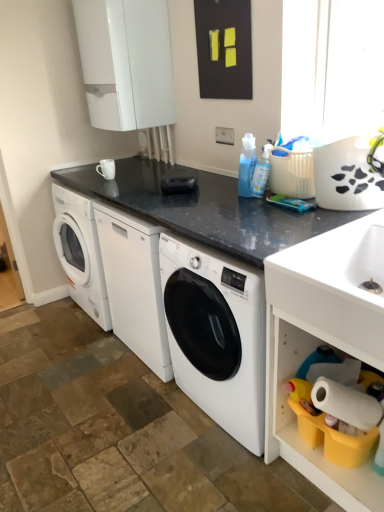
What is the approximate height of blue glossy bottle at center?

The height of blue glossy bottle at center is 10.98 inches.

This screenshot has width=384, height=512. What do you see at coordinates (205, 209) in the screenshot?
I see `black granite countertop at center` at bounding box center [205, 209].

What do you see at coordinates (335, 286) in the screenshot?
I see `white glossy sink at lower right` at bounding box center [335, 286].

Locate an element on the screen. The width and height of the screenshot is (384, 512). blue glossy bottle at center is located at coordinates (246, 165).

Is white glossy sink at lower right located within white plastic shelf at lower right?

Yes, white plastic shelf at lower right is surrounding white glossy sink at lower right.

Measure the distance from white plastic shelf at lower right to white glossy sink at lower right.

11.24 inches.

Is white glossy sink at lower right at the back of white plastic shelf at lower right?

No, white plastic shelf at lower right's orientation is not away from white glossy sink at lower right.

Does point (309, 450) lie in front of point (328, 328)?

That is False.

Can white glossy sink at lower right be found inside black granite countertop at center?

No, white glossy sink at lower right is not inside black granite countertop at center.

Which is in front, point (332, 220) or point (315, 312)?

Positioned in front is point (315, 312).

Considering the sizes of objects black granite countertop at center and white glossy sink at lower right in the image provided, who is wider, black granite countertop at center or white glossy sink at lower right?

With larger width is black granite countertop at center.

From the picture: Is black granite countertop at center looking in the opposite direction of white glossy sink at lower right?

black granite countertop at center is not turned away from white glossy sink at lower right.

From the image's perspective, is black granite countertop at center positioned above or below blue glossy bottle at center?

From the image's perspective, black granite countertop at center appears below blue glossy bottle at center.

Looking at this image, is black granite countertop at center placed right next to blue glossy bottle at center?

black granite countertop at center and blue glossy bottle at center are clearly separated.

Considering the relative positions of black granite countertop at center and blue glossy bottle at center in the image provided, is black granite countertop at center to the right of blue glossy bottle at center from the viewer's perspective?

No.

From a real-world perspective, is white plastic shelf at lower right positioned under black granite countertop at center based on gravity?

Yes.

Identify the location of shelf below the black granite countertop at center (from a real-world perspective). The width and height of the screenshot is (384, 512). (295, 417).

From the image's perspective, between white plastic shelf at lower right and black granite countertop at center, who is located below?

From the image's view, white plastic shelf at lower right is below.

Would you consider white plastic shelf at lower right to be distant from blue glossy bottle at center?

No, white plastic shelf at lower right is in close proximity to blue glossy bottle at center.

Is white plastic shelf at lower right wider or thinner than blue glossy bottle at center?

Clearly, white plastic shelf at lower right has more width compared to blue glossy bottle at center.

Considering the sizes of white plastic shelf at lower right and blue glossy bottle at center in the image, is white plastic shelf at lower right bigger or smaller than blue glossy bottle at center?

white plastic shelf at lower right is bigger than blue glossy bottle at center.

Which is more to the right, white plastic shelf at lower right or blue glossy bottle at center?

white plastic shelf at lower right.

Which object is wider, blue glossy bottle at center or white glossy sink at lower right?

With larger width is white glossy sink at lower right.

Based on the photo, is blue glossy bottle at center positioned in front of white glossy sink at lower right?

No, blue glossy bottle at center is behind white glossy sink at lower right.

From the image's perspective, relative to white glossy sink at lower right, is blue glossy bottle at center above or below?

Based on their image positions, blue glossy bottle at center is located above white glossy sink at lower right.

How distant is blue glossy bottle at center from white glossy sink at lower right?

blue glossy bottle at center and white glossy sink at lower right are 28.29 inches apart.

What's the angular difference between white glossy sink at lower right and white plastic shelf at lower right's facing directions?

The angular difference between white glossy sink at lower right and white plastic shelf at lower right is 1.68 degrees.

Is white glossy sink at lower right aimed at white plastic shelf at lower right?

Yes, white glossy sink at lower right is oriented towards white plastic shelf at lower right.

From the image's perspective, is white glossy sink at lower right under white plastic shelf at lower right?

No, from the image's perspective, white glossy sink at lower right is not beneath white plastic shelf at lower right.

From a real-world perspective, which object stands above the other?

In real-world perspective, white glossy sink at lower right is above.

Where is `shelf that appears in front of the white glossy sink at lower right`? shelf that appears in front of the white glossy sink at lower right is located at coordinates (295, 417).

Locate an element on the screen. countertop on the left of white glossy sink at lower right is located at coordinates (205, 209).

Which object lies further to the anchor point white glossy sink at lower right, black granite countertop at center or blue glossy bottle at center?

blue glossy bottle at center is further to white glossy sink at lower right.

Based on the photo, estimate the real-world distances between objects in this image. Which object is further from white plastic shelf at lower right, black granite countertop at center or white glossy sink at lower right?

black granite countertop at center is positioned further to the anchor white plastic shelf at lower right.

From the picture: Looking at the image, which one is located closer to white plastic shelf at lower right, blue glossy bottle at center or white glossy sink at lower right?

white glossy sink at lower right is positioned closer to the anchor white plastic shelf at lower right.

Looking at the image, which one is located closer to blue glossy bottle at center, black granite countertop at center or white plastic shelf at lower right?

The object closer to blue glossy bottle at center is black granite countertop at center.

From the image, which object appears to be nearer to white glossy sink at lower right, white plastic shelf at lower right or blue glossy bottle at center?

Among the two, white plastic shelf at lower right is located nearer to white glossy sink at lower right.

From the image, which object appears to be farther from black granite countertop at center, white glossy sink at lower right or white plastic shelf at lower right?

→ The object further to black granite countertop at center is white plastic shelf at lower right.

Which object lies nearer to the anchor point blue glossy bottle at center, white glossy sink at lower right or black granite countertop at center?

black granite countertop at center is positioned closer to the anchor blue glossy bottle at center.

Estimate the real-world distances between objects in this image. Which object is further from blue glossy bottle at center, black granite countertop at center or white glossy sink at lower right?

white glossy sink at lower right.

This screenshot has width=384, height=512. Identify the location of countertop located between white glossy sink at lower right and blue glossy bottle at center in the depth direction. (205, 209).

I want to click on countertop between white plastic shelf at lower right and blue glossy bottle at center along the z-axis, so click(205, 209).

In order to click on sink between black granite countertop at center and white plastic shelf at lower right from left to right in this screenshot , I will do `click(335, 286)`.

Identify the location of sink between white plastic shelf at lower right and blue glossy bottle at center from front to back. (335, 286).